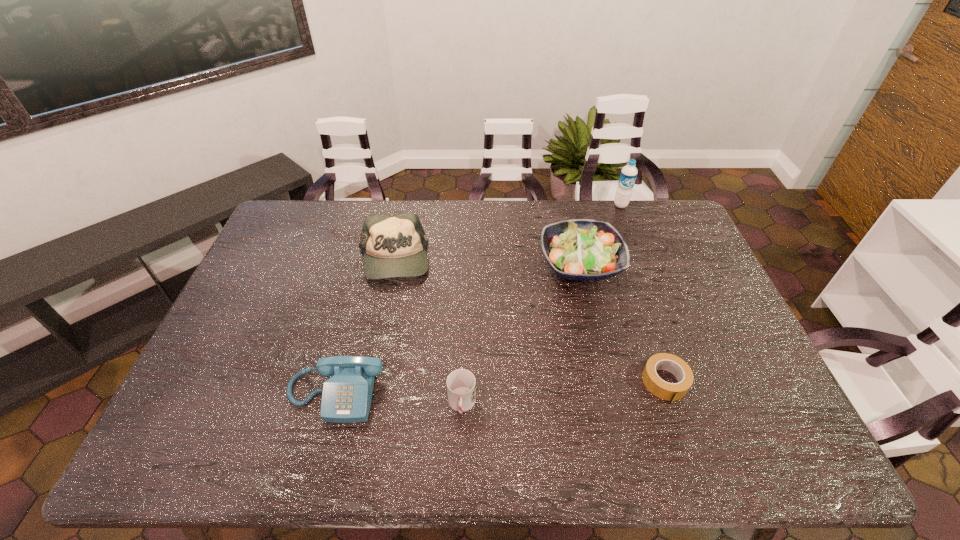
You are a GUI agent. You are given a task and a screenshot of the screen. Output one action in this format:
    pyautogui.click(x=<x>, y=<y>)
    Task: Click on the farthest object
    The image size is (960, 540).
    Given the screenshot: What is the action you would take?
    pyautogui.click(x=628, y=175)

Locate an element on the screen. This screenshot has width=960, height=540. the tallest object is located at coordinates (628, 175).

Where is `baseball cap`? baseball cap is located at coordinates (394, 246).

The image size is (960, 540). What are the coordinates of `salad plate` in the screenshot? It's located at (580, 249).

You are a GUI agent. You are given a task and a screenshot of the screen. Output one action in this format:
    pyautogui.click(x=<x>, y=<y>)
    Task: Click on the telephone
    This screenshot has height=540, width=960.
    Given the screenshot: What is the action you would take?
    pyautogui.click(x=346, y=397)

Find the location of a particular element. The image size is (960, 540). the third object from left to right is located at coordinates (461, 388).

Where is `duct tape`? duct tape is located at coordinates (679, 368).

The height and width of the screenshot is (540, 960). In order to click on vacant space located on the label of the farthest object in this screenshot , I will do click(635, 240).

The height and width of the screenshot is (540, 960). In order to click on vacant space situated 0.060m on the front-facing side of the baseball cap in this screenshot , I will do `click(384, 302)`.

Where is `free point located 0.070m on the left of the salad plate`? This screenshot has width=960, height=540. free point located 0.070m on the left of the salad plate is located at coordinates (518, 264).